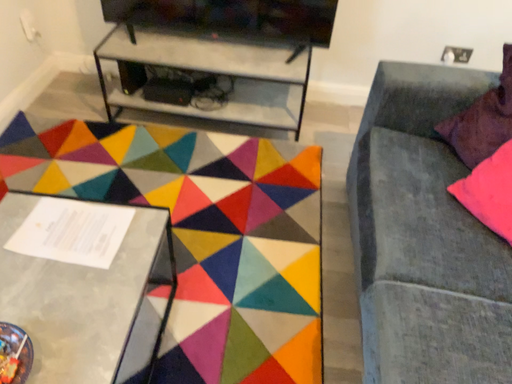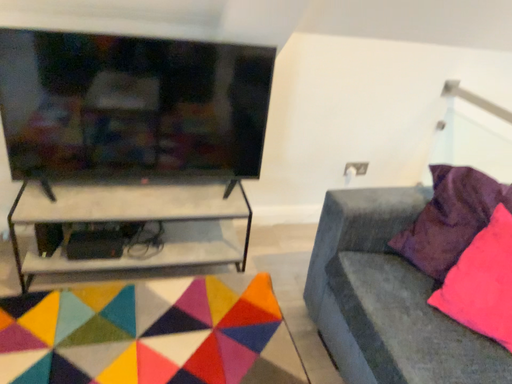
Question: How did the camera likely rotate when shooting the video?

Choices:
 (A) rotated left
 (B) rotated right

Answer: (B)